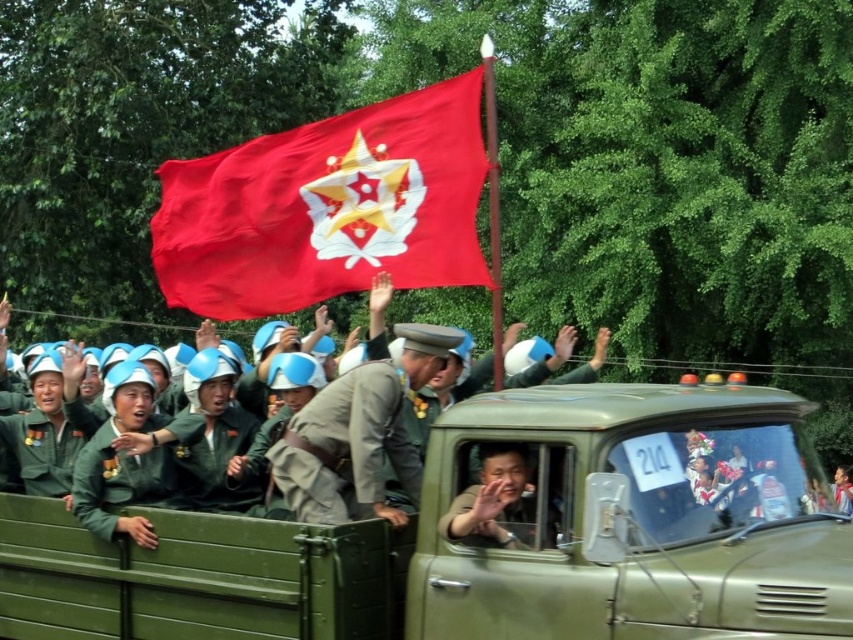
Is point (486, 440) less distant than point (229, 304)?

Yes, point (486, 440) is closer to viewer.

Can you confirm if green matte truck at center is bigger than red matte flag at center?

Indeed, green matte truck at center has a larger size compared to red matte flag at center.

Identify the location of green matte truck at center. This screenshot has height=640, width=853. (486, 541).

Who is positioned more to the left, khaki uniform at center or matte green uniform at center?

khaki uniform at center

Does khaki uniform at center come in front of matte green uniform at center?

Yes.

The height and width of the screenshot is (640, 853). In order to click on khaki uniform at center in this screenshot , I will do `click(358, 433)`.

This screenshot has width=853, height=640. In order to click on khaki uniform at center in this screenshot , I will do `click(358, 433)`.

Is red matte flag at center positioned in front of matte green uniform at center?

No, red matte flag at center is further to the viewer.

Can you confirm if red matte flag at center is shorter than matte green uniform at center?

No.

Locate an element on the screen. The width and height of the screenshot is (853, 640). red matte flag at center is located at coordinates (329, 209).